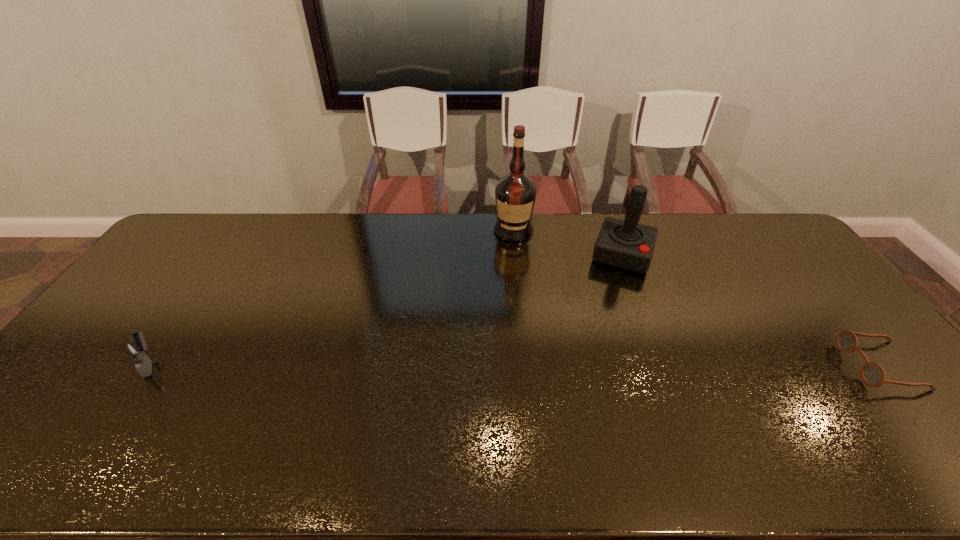
Find the location of `vacant spot on the desktop that is between the igniter and the rightmost object and is positioned on the base of the joystick`. vacant spot on the desktop that is between the igniter and the rightmost object and is positioned on the base of the joystick is located at coordinates (589, 364).

Image resolution: width=960 pixels, height=540 pixels. In order to click on vacant space on the desktop that is between the second shortest object and the shortest object and is positioned on the surface of the tallest object in this screenshot , I will do `click(499, 364)`.